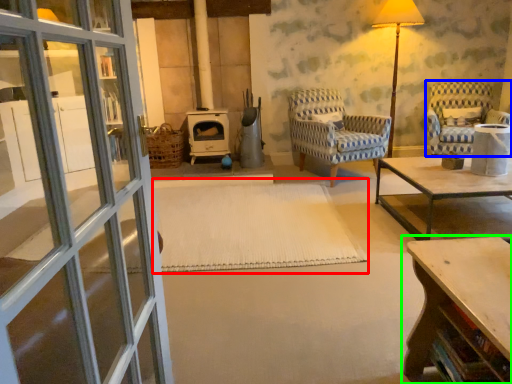
Question: Considering the real-world distances, which object is farthest from mat (highlighted by a red box)? chair (highlighted by a blue box) or table (highlighted by a green box)?

Choices:
 (A) chair
 (B) table

Answer: (A)